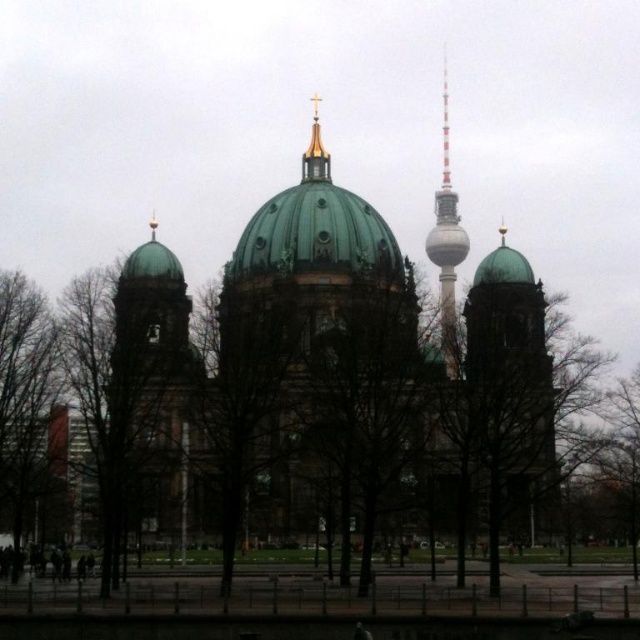
Which is more to the left, bare branches at left or gold-plated spire at upper center?

bare branches at left

Locate an element on the screen. bare branches at left is located at coordinates (24, 403).

Who is more forward, (13, 380) or (305, 161)?

Point (13, 380)

Find the location of a particular element. This screenshot has height=640, width=640. bare branches at left is located at coordinates (24, 403).

Who is taller, bare branches at left or white glass tower at upper right?

Standing taller between the two is white glass tower at upper right.

Is bare branches at left shorter than white glass tower at upper right?

Indeed, bare branches at left has a lesser height compared to white glass tower at upper right.

Find the location of a particular element. The image size is (640, 640). bare branches at left is located at coordinates (24, 403).

This screenshot has width=640, height=640. Describe the element at coordinates (445, 243) in the screenshot. I see `white glass tower at upper right` at that location.

Image resolution: width=640 pixels, height=640 pixels. What are the coordinates of `white glass tower at upper right` in the screenshot? It's located at (445, 243).

Who is more distant from viewer, (440,312) or (304,164)?

Positioned behind is point (304,164).

Find the location of `white glass tower at upper right`. white glass tower at upper right is located at coordinates (445, 243).